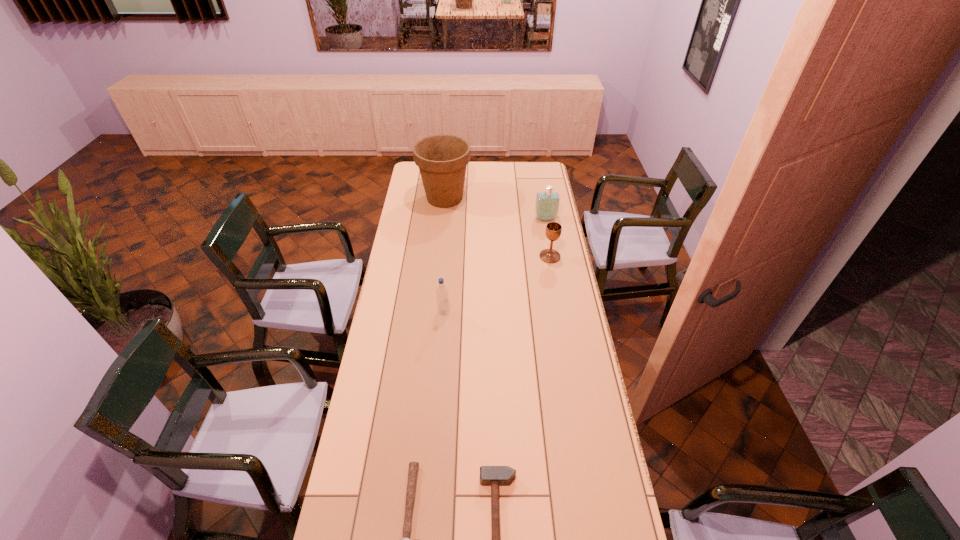
At what (x,y) coordinates should I click in order to perform the action: click on flowerpot. Please return your answer as a coordinate pair (x, y). This screenshot has width=960, height=540. Looking at the image, I should click on (442, 159).

This screenshot has width=960, height=540. What are the coordinates of `the tallest object` in the screenshot? It's located at (442, 159).

The image size is (960, 540). What are the coordinates of `the fifth nearest object` in the screenshot? It's located at (547, 203).

Find the location of a particular element. the fourth farthest object is located at coordinates (441, 292).

I want to click on the fourth nearest object, so click(553, 230).

Locate an element on the screen. This screenshot has height=540, width=960. vacant space located on the back of the farthest object is located at coordinates (447, 174).

Where is `free region located 0.260m on the front label of the perfume`? This screenshot has height=540, width=960. free region located 0.260m on the front label of the perfume is located at coordinates (552, 255).

Find the location of a particular element. This screenshot has width=960, height=540. vacant point located on the left of the water bottle is located at coordinates (397, 313).

Locate an element on the screen. The image size is (960, 540). free point located 0.260m on the back of the fourth nearest object is located at coordinates (543, 218).

Locate an element on the screen. This screenshot has height=540, width=960. object situated at the left edge is located at coordinates (442, 159).